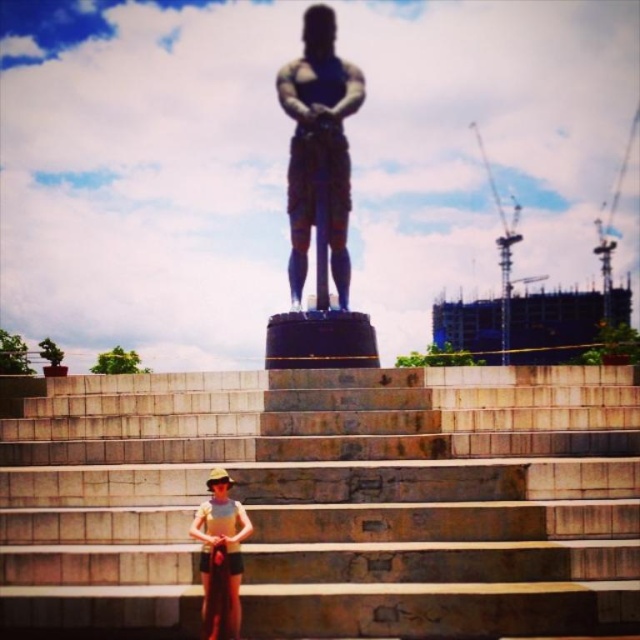
Question: Estimate the real-world distances between objects in this image. Which object is farther from the bronze statue at center?

Choices:
 (A) tan fabric shorts at center
 (B) brown stone stairs at center

Answer: (A)

Question: Among these points, which one is farthest from the camera?

Choices:
 (A) (212, 499)
 (B) (298, 282)
 (C) (538, 435)

Answer: (B)

Question: Can you confirm if bronze statue at center is thinner than tan fabric shorts at center?

Choices:
 (A) no
 (B) yes

Answer: (A)

Question: Is brown stone stairs at center to the right of bronze statue at center from the viewer's perspective?

Choices:
 (A) no
 (B) yes

Answer: (B)

Question: Estimate the real-world distances between objects in this image. Which object is farther from the brown stone stairs at center?

Choices:
 (A) tan fabric shorts at center
 (B) bronze statue at center

Answer: (B)

Question: Is brown stone stairs at center thinner than tan fabric shorts at center?

Choices:
 (A) yes
 (B) no

Answer: (B)